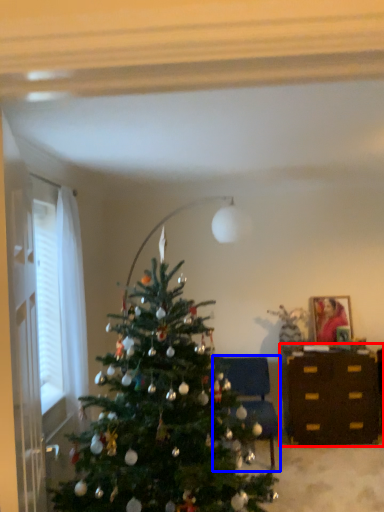
Question: Which object appears closest to the camera in this image, desk (highlighted by a red box) or furniture (highlighted by a blue box)?

Choices:
 (A) desk
 (B) furniture

Answer: (B)